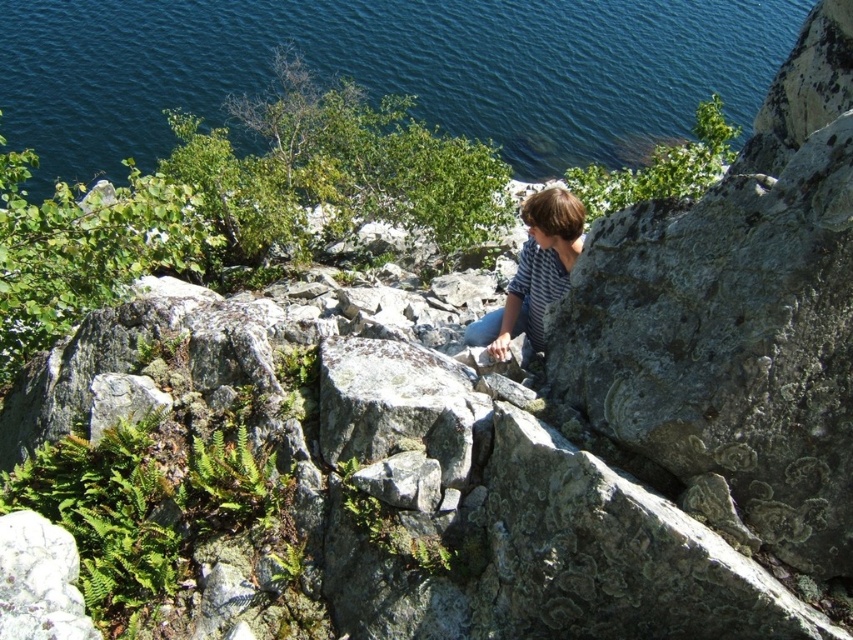
You are planning to take a photo of the blue water at upper center and the striped cotton shirt at center. Which object appears larger in the image?

The blue water at upper center appears larger because it is much taller than the striped cotton shirt at center.

You are a hiker who wants to take a photo of the blue water at upper center without getting your striped cotton shirt at center wet. Can you stand on the rocks and take the photo while keeping your shirt dry?

The blue water at upper center is above the striped cotton shirt at center, so you can safely stand on the rocks and take the photo without getting your shirt wet.